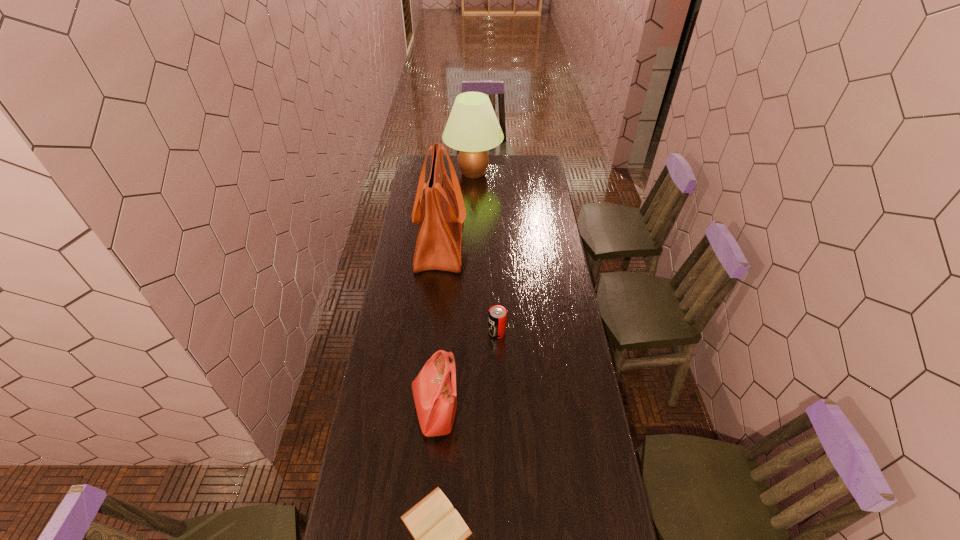
The image size is (960, 540). What are the coordinates of `vacant space that satisfies the following two spatial constraints: 1. on the shade of the farthest object; 2. on the left side of the second shortest object` in the screenshot? It's located at (470, 333).

You are a GUI agent. You are given a task and a screenshot of the screen. Output one action in this format:
    pyautogui.click(x=<x>, y=<y>)
    Task: Click on the free space that satisfies the following two spatial constraints: 1. on the shade of the can; 2. on the left side of the lampshade
    
    Given the screenshot: What is the action you would take?
    pyautogui.click(x=470, y=333)